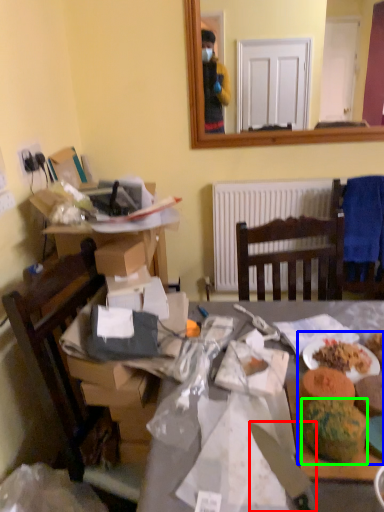
Question: Considering the real-world distances, which object is farthest from knife (highlighted by a red box)? food (highlighted by a blue box) or watermelon (highlighted by a green box)?

Choices:
 (A) food
 (B) watermelon

Answer: (A)